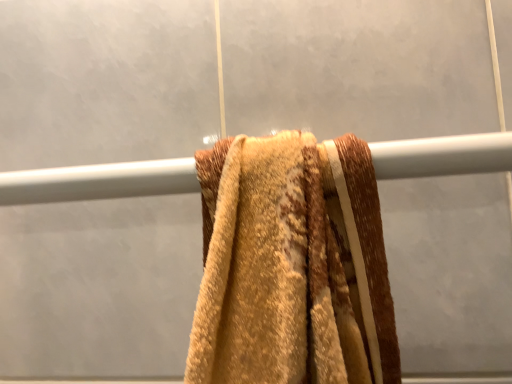
The image size is (512, 384). What are the coordinates of `metallic silver towel bar at center` in the screenshot? It's located at (99, 182).

What do you see at coordinates (99, 182) in the screenshot? This screenshot has width=512, height=384. I see `metallic silver towel bar at center` at bounding box center [99, 182].

This screenshot has width=512, height=384. In order to click on metallic silver towel bar at center in this screenshot , I will do `click(99, 182)`.